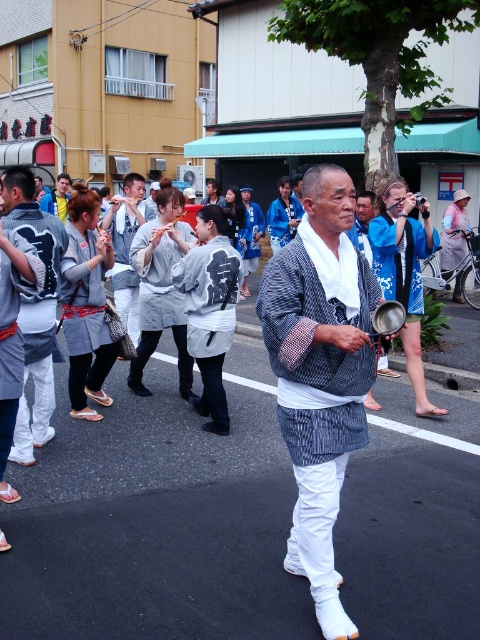
Question: Among these objects, which one is nearest to the camera?

Choices:
 (A) white striped kimono at center
 (B) white cotton kimono at center
 (C) gray fabric kimono at center

Answer: (A)

Question: Considering the relative positions of white striped kimono at center and gray fabric kimono at center in the image provided, where is white striped kimono at center located with respect to gray fabric kimono at center?

Choices:
 (A) below
 (B) above

Answer: (B)

Question: Is white striped kimono at center above gray fabric kimono at center?

Choices:
 (A) yes
 (B) no

Answer: (A)

Question: Which object is farther from the camera taking this photo?

Choices:
 (A) gray fabric kimono at center
 (B) white cotton kimono at center

Answer: (B)

Question: Which of these objects is positioned farthest from the white striped kimono at center?

Choices:
 (A) white cotton kimono at center
 (B) gray fabric kimono at center

Answer: (A)

Question: Is white striped kimono at center wider than gray fabric kimono at center?

Choices:
 (A) yes
 (B) no

Answer: (A)